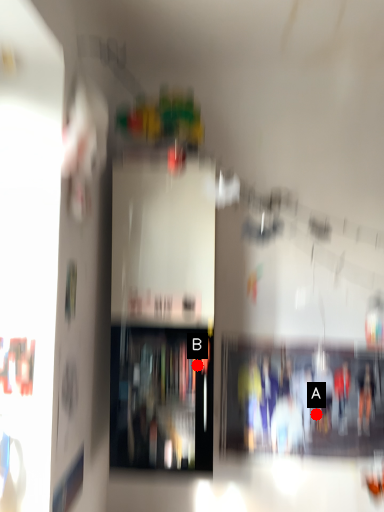
Question: Two points are circled on the image, labeled by A and B beside each circle. Which point appears farthest from the camera in this image?

Choices:
 (A) A is further
 (B) B is further

Answer: (A)